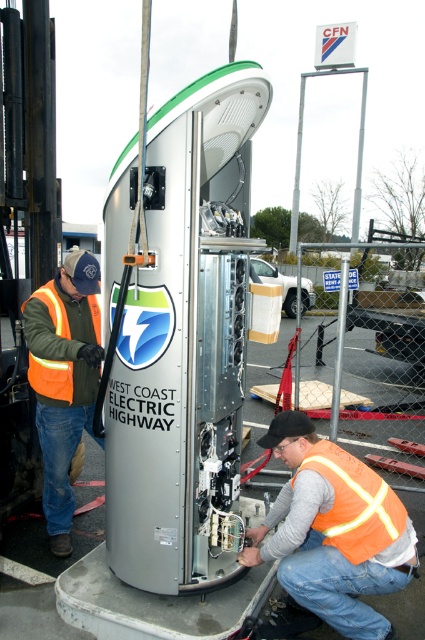
Question: Which point is closer to the camera?

Choices:
 (A) (314, 476)
 (B) (65, 292)
 (C) (99, 323)
 (D) (362, 502)

Answer: (D)

Question: Which point is closer to the camera taking this photo?

Choices:
 (A) (90, 384)
 (B) (357, 520)

Answer: (B)

Question: Is orange reflective vest at lower center positioned in front of hi-visibility reflective safety vest at left?

Choices:
 (A) no
 (B) yes

Answer: (B)

Question: Is hi-visibility reflective safety vest at left further to the viewer compared to orange reflective safety vest at lower center?

Choices:
 (A) no
 (B) yes

Answer: (B)

Question: Which point is farther to the camera?

Choices:
 (A) hi-visibility reflective safety vest at left
 (B) orange reflective vest at lower center
 (C) orange reflective safety vest at lower center

Answer: (A)

Question: Does orange reflective vest at left appear under orange reflective safety vest at lower center?

Choices:
 (A) yes
 (B) no

Answer: (B)